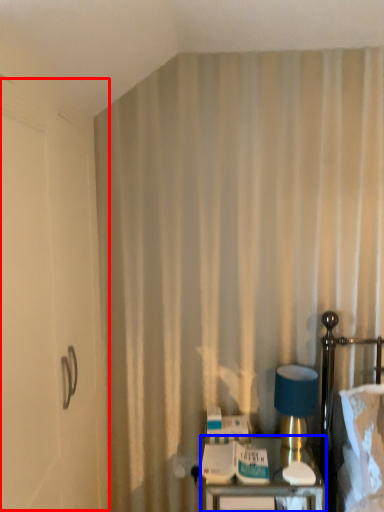
Question: Among these objects, which one is farthest to the camera, screen door (highlighted by a red box) or furniture (highlighted by a blue box)?

Choices:
 (A) screen door
 (B) furniture

Answer: (B)